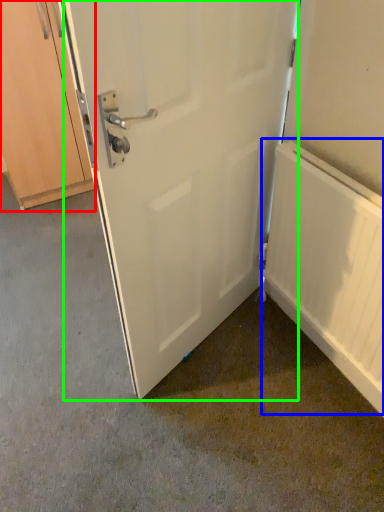
Question: Considering the real-world distances, which object is closest to cabinetry (highlighted by a red box)? radiator (highlighted by a blue box) or door (highlighted by a green box).

Choices:
 (A) radiator
 (B) door

Answer: (B)